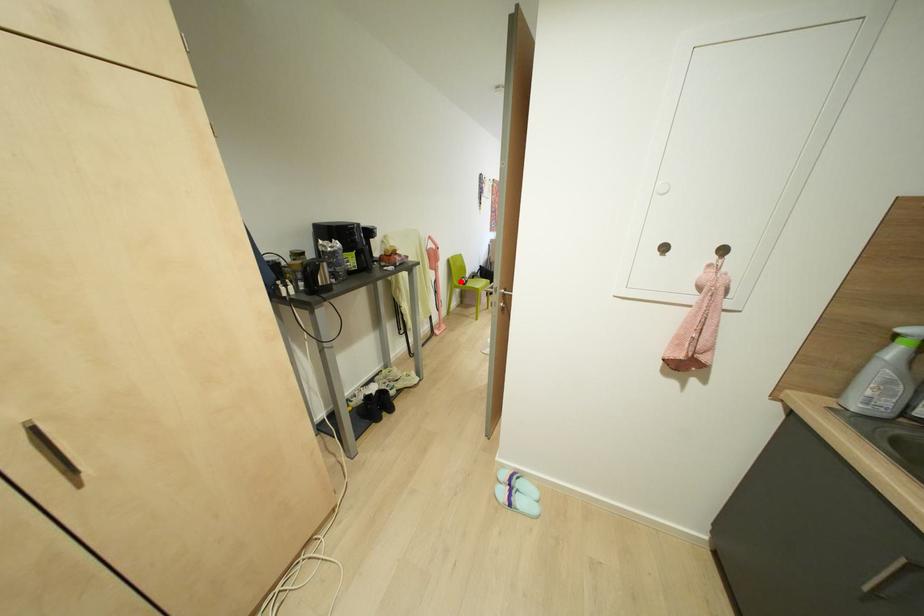
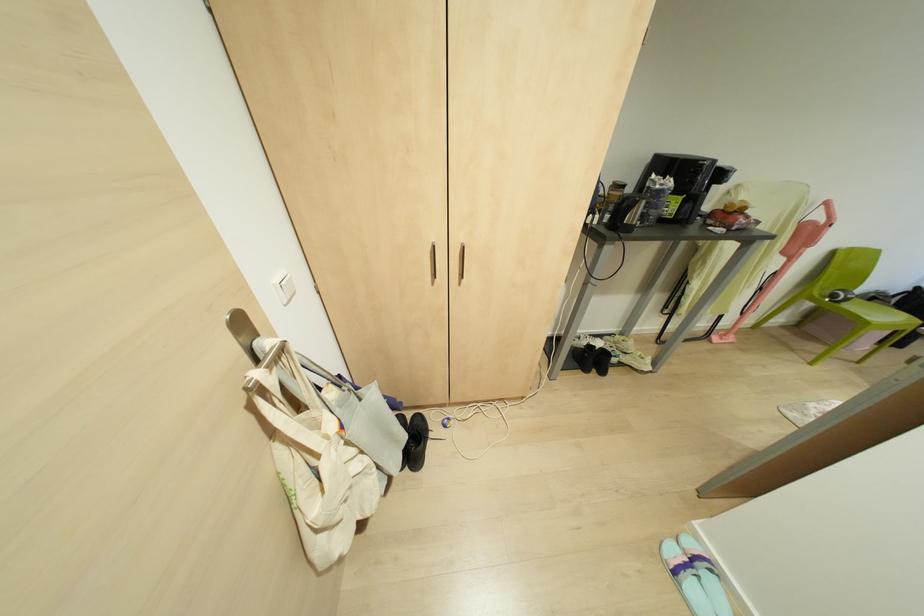
Question: I am providing you with two images of the same scene from different viewpoints. Given a red point in image1, look at the same physical point in image2. Is it:

Choices:
 (A) Closer to the viewpoint
 (B) Farther from the viewpoint

Answer: (B)